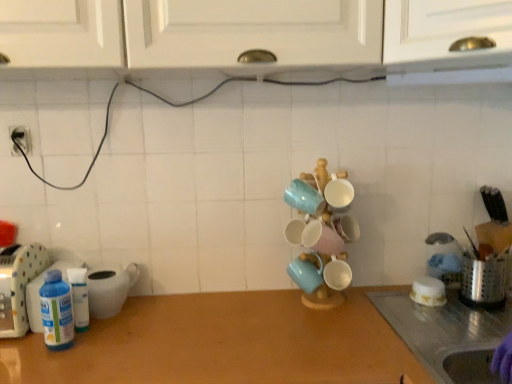
Question: Looking at their shapes, would you say white glossy cabinet at upper center is wider or thinner than white glossy bowl at right, which is counted as the third tableware, starting from the left?

Choices:
 (A) wide
 (B) thin

Answer: (A)

Question: Is white glossy cabinet at upper center taller or shorter than white glossy bowl at right, which appears as the first tableware when viewed from the right?

Choices:
 (A) tall
 (B) short

Answer: (A)

Question: Based on their relative distances, which object is farther from the purple rubber glove at lower right?

Choices:
 (A) white plastic container at left, positioned as the 3th appliance in left-to-right order
 (B) white glossy bowl at right, which is counted as the third tableware, starting from the left
 (C) translucent plastic bottle at left
 (D) matte blue mug at center, the 3th tableware from the right
 (E) white glossy cabinet at upper center

Answer: (C)

Question: Estimate the real-world distances between objects in this image. Which object is closer to the white glossy cabinet at upper center?

Choices:
 (A) purple rubber glove at lower right
 (B) matte blue mug at center, the first tableware viewed from the left
 (C) white plastic container at left, positioned as the 3th appliance in left-to-right order
 (D) white plastic bottle at left, which is counted as the fourth appliance, starting from the right
 (E) translucent plastic bottles at left, acting as the 3th appliance starting from the right

Answer: (B)